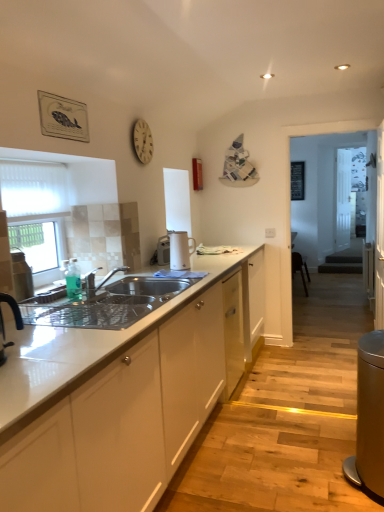
Identify the location of free space to the left of metallic trash can at right, the first appliance viewed from the right. The height and width of the screenshot is (512, 384). (302, 480).